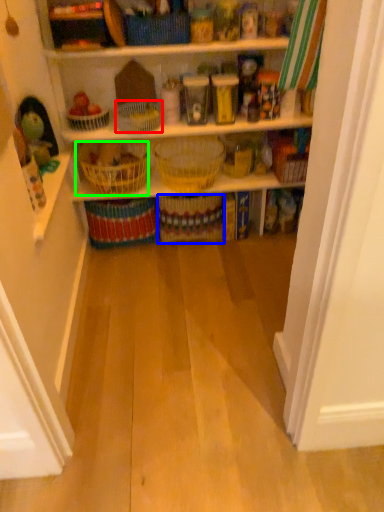
Question: Which object is positioned closest to basket (highlighted by a red box)? Select from basket (highlighted by a blue box) and basket (highlighted by a green box).

Choices:
 (A) basket
 (B) basket

Answer: (B)